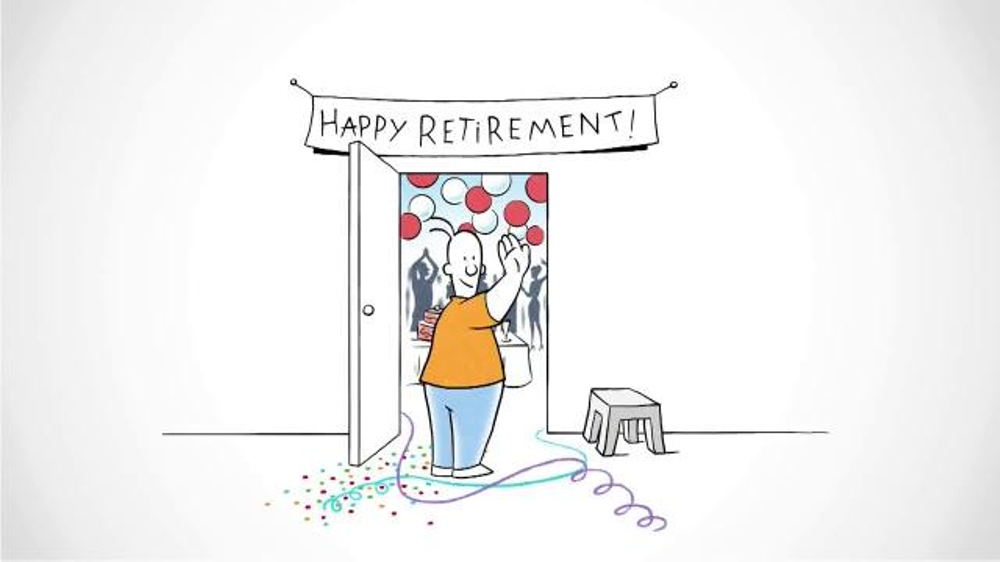
The height and width of the screenshot is (562, 1000). Find the location of `door drawing`. door drawing is located at coordinates (368, 310), (360, 294), (361, 460), (396, 174), (376, 262).